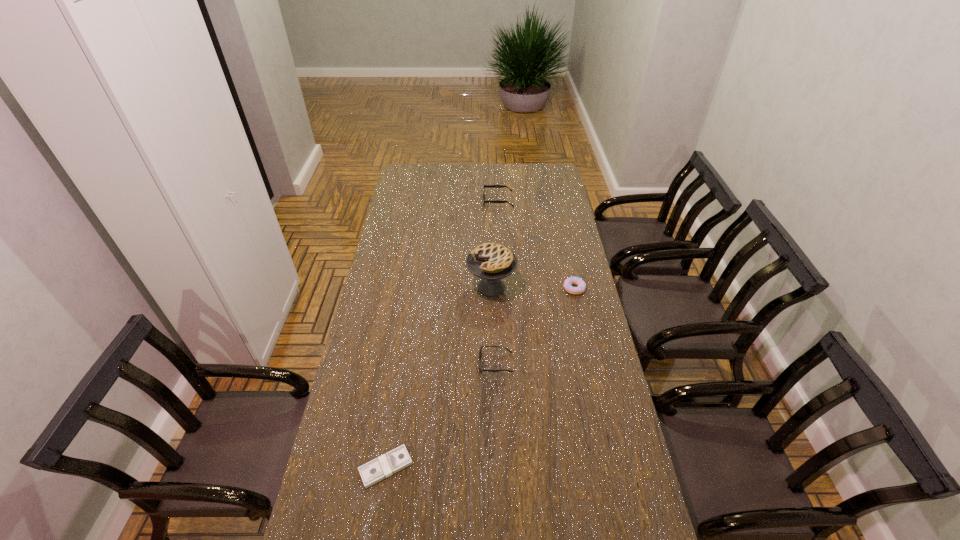
Where is `object at the right edge`? object at the right edge is located at coordinates (569, 281).

In the image, there is a desktop. Identify the location of vacant area at the far edge. The image size is (960, 540). (501, 180).

In the image, there is a desktop. Where is `blank space at the left edge`? blank space at the left edge is located at coordinates (384, 246).

Identify the location of vacant area at the right edge. (565, 226).

Find the location of a particular element. Image resolution: width=960 pixels, height=540 pixels. free space at the far left corner of the desktop is located at coordinates (404, 183).

At what (x,y) coordinates should I click in order to perform the action: click on vacant space at the far right corner of the desktop. Please return your answer as a coordinate pair (x, y). This screenshot has height=540, width=960. Looking at the image, I should click on (556, 166).

Locate an element on the screen. free space between the shortest object and the tallest object is located at coordinates (439, 377).

In order to click on vacant area between the tallest object and the rightmost object in this screenshot , I will do `click(533, 288)`.

Identify the location of free space between the rightmost object and the pie. 533,288.

This screenshot has width=960, height=540. Find the location of `free space between the shorter sunglasses and the rightmost object`. free space between the shorter sunglasses and the rightmost object is located at coordinates (535, 326).